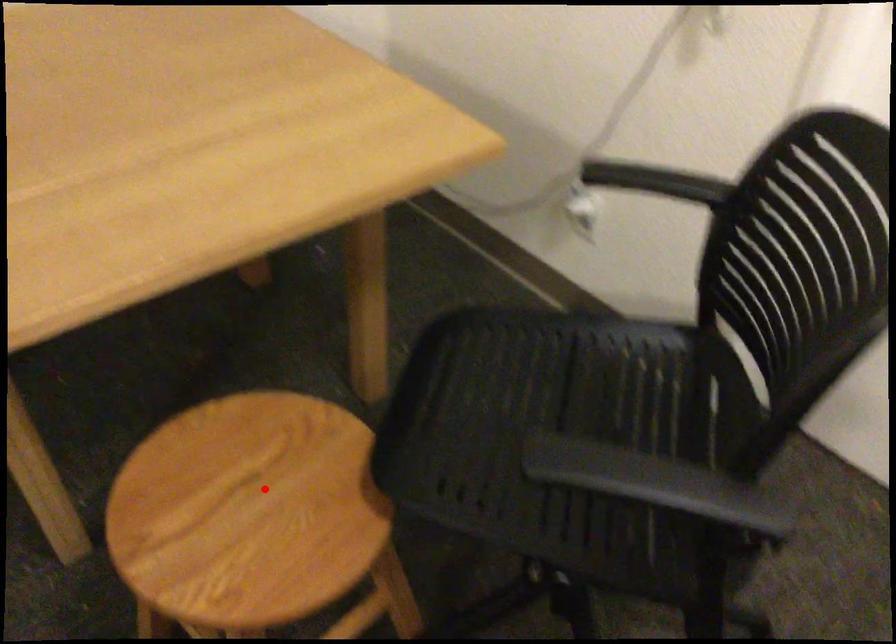
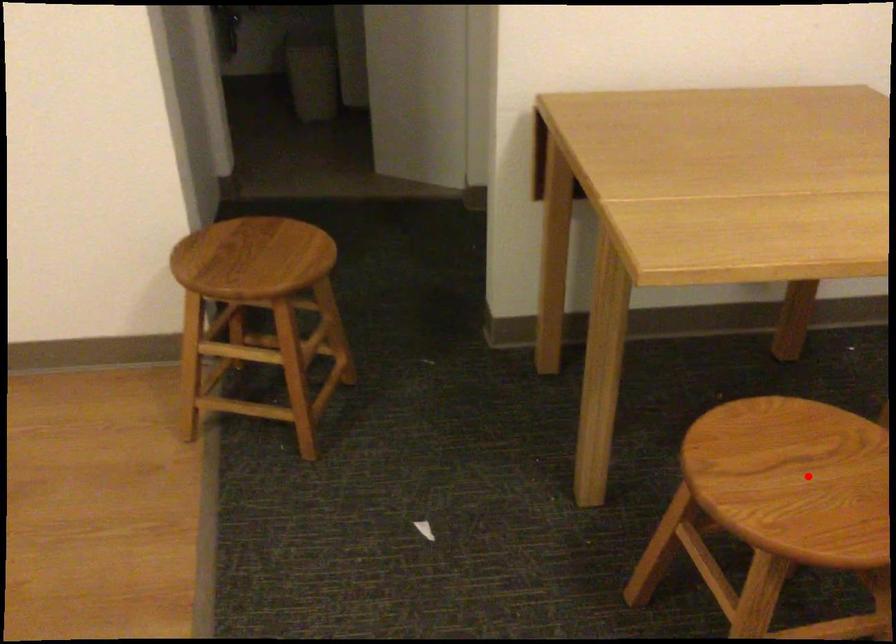
I am providing you with two images of the same scene from different viewpoints. A red point is marked on the first image and another point is marked on the second image. Does the point marked in image1 correspond to the same location as the one in image2?

Yes